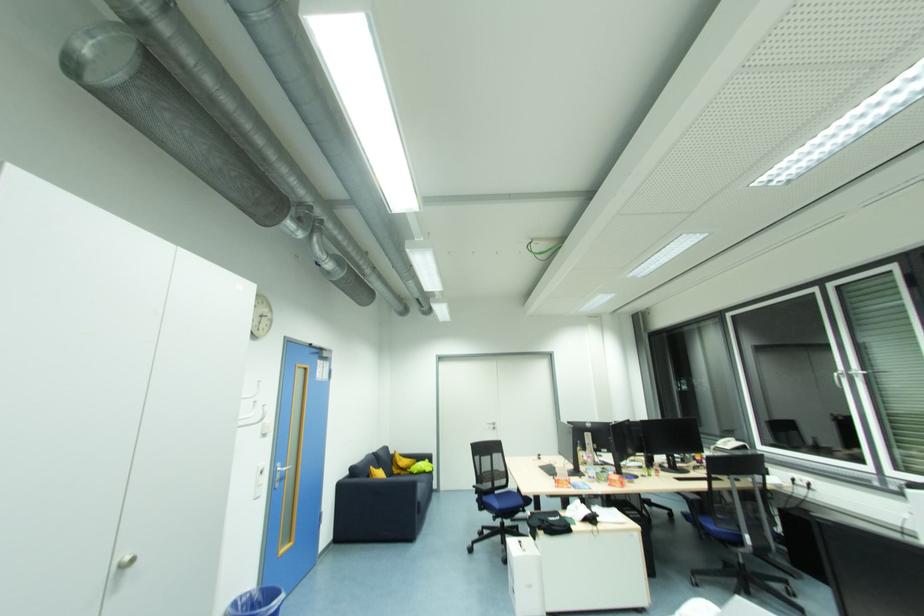
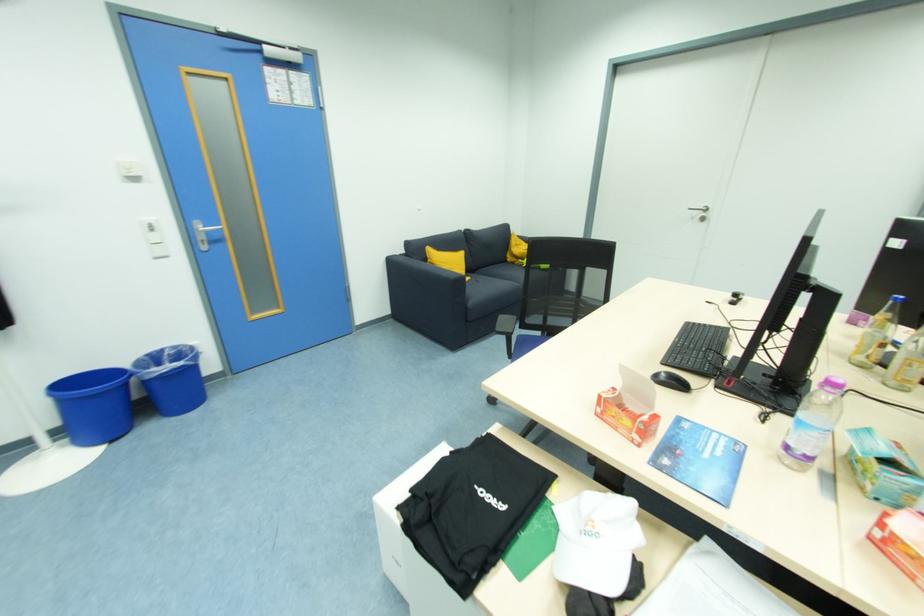
In the second image, find the point that corresponds to [592,479] in the first image.

(792, 448)